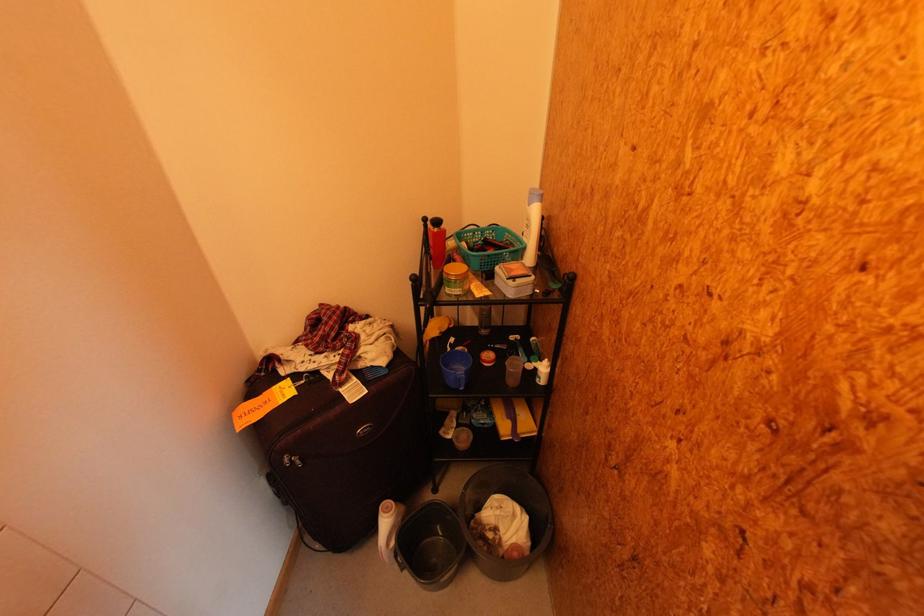
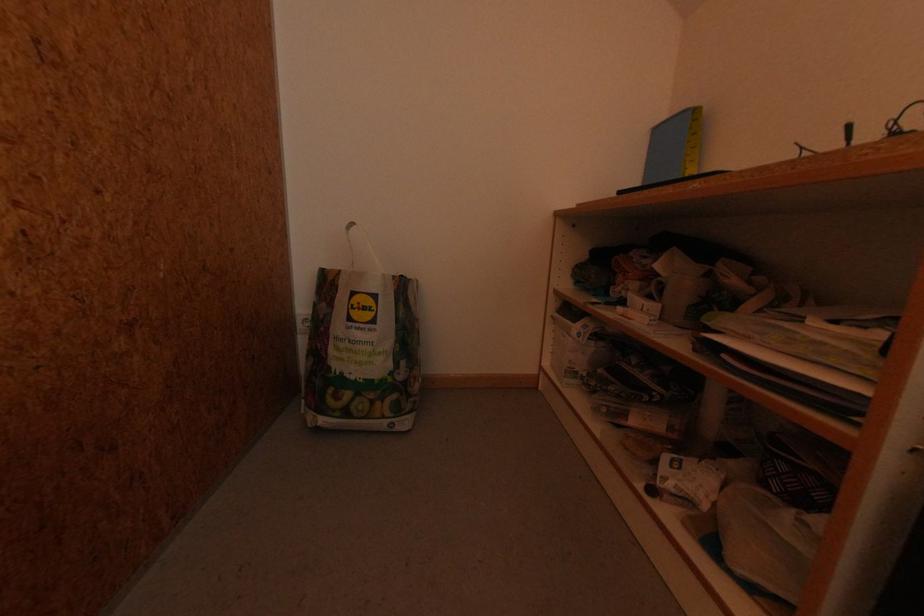
In a continuous first-person perspective shot, in which direction is the camera moving?

The movement direction of the cameraman is right, forward.